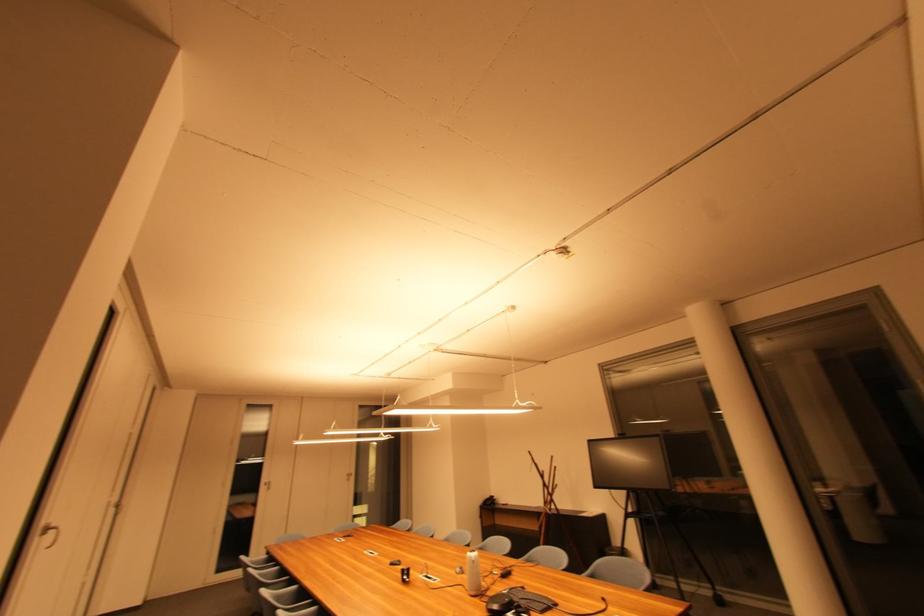
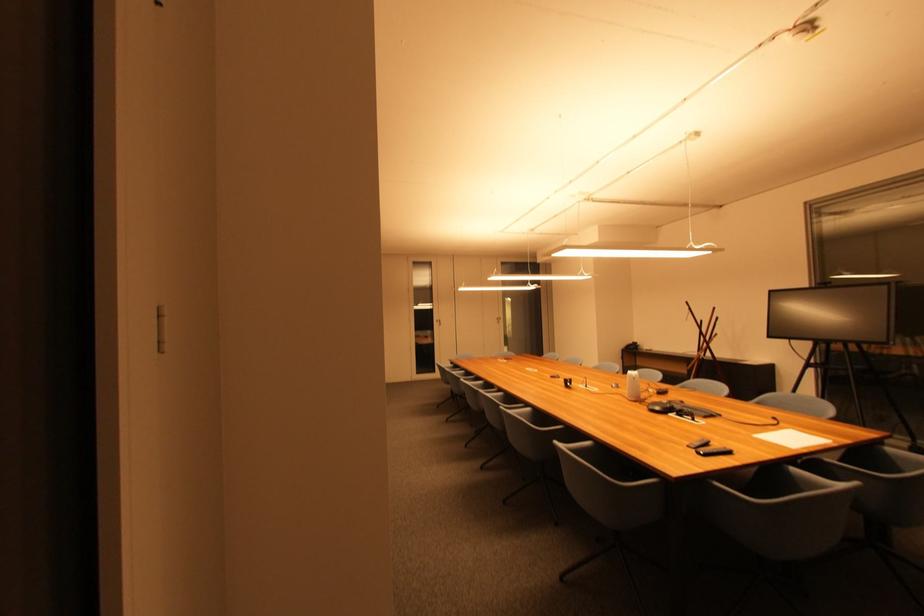
Based on the continuous images, in which direction is the camera rotating?

The camera's rotation is toward left-down.